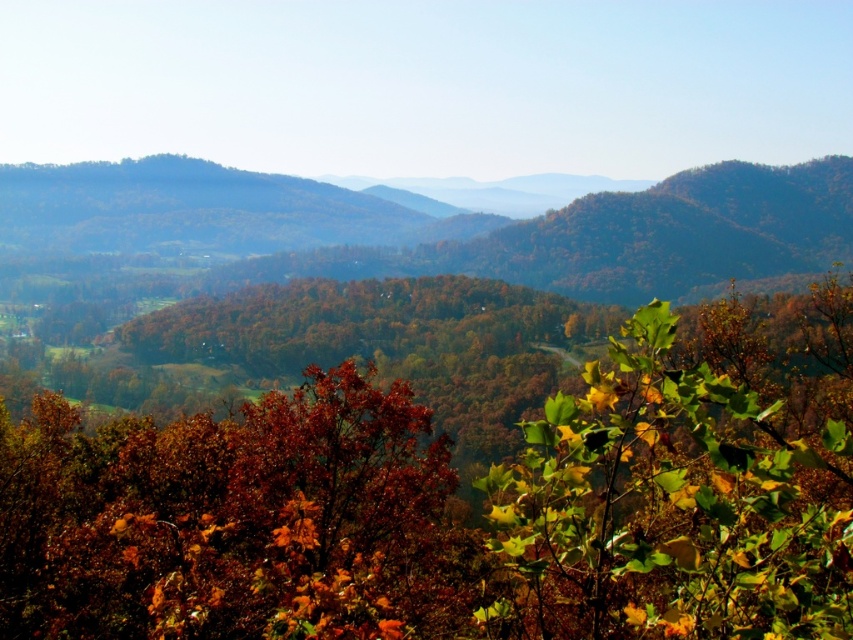
You are a hiker standing in the mountain landscape and want to take a photo of the autumn leaves at center and the green leafy bush at center. Which one should you focus on first if you want both to be in sharp focus?

The autumn leaves at center is below green leafy bush at center, so you should focus on the green leafy bush at center first to ensure both are in sharp focus.

You are standing in the mountainous landscape and want to take a photo focusing on the autumn leaves at center and the green leafy bush at center. Which object should you adjust your camera focus to first to ensure both are in the frame?

Since the autumn leaves at center is closer to you than the green leafy bush at center, you should first focus on the autumn leaves at center to ensure both are in the frame.

You are an artist planning to paint the autumn scene in the image. You want to place the autumn leaves at center and the green leafy bush at center in your painting. According to the image, which one should you draw first if you are following a left to right painting technique?

The autumn leaves at center should be drawn first because it is positioned on the left side of the green leafy bush at center, so following a left to right painting technique, you should start with the autumn leaves at center before moving to the green leafy bush at center.